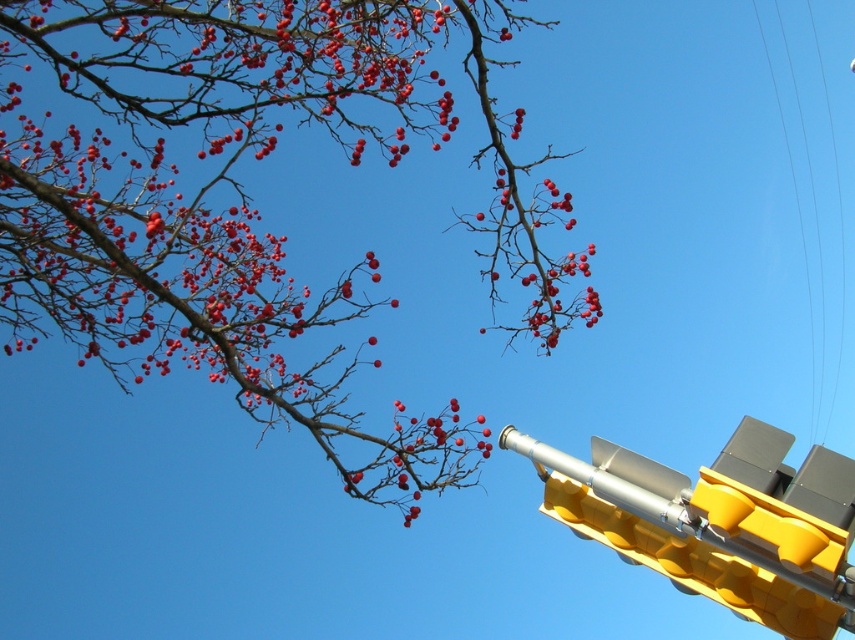
Between point (346, 22) and point (736, 444), which one is positioned in front?

Point (736, 444) is in front.

Does smooth red berries at upper left have a greater height compared to yellow plastic traffic light at lower right?

No, smooth red berries at upper left is not taller than yellow plastic traffic light at lower right.

Is point (146, 243) closer to viewer compared to point (761, 426)?

No, it is behind (761, 426).

Identify the location of smooth red berries at upper left. This screenshot has height=640, width=855. (251, 200).